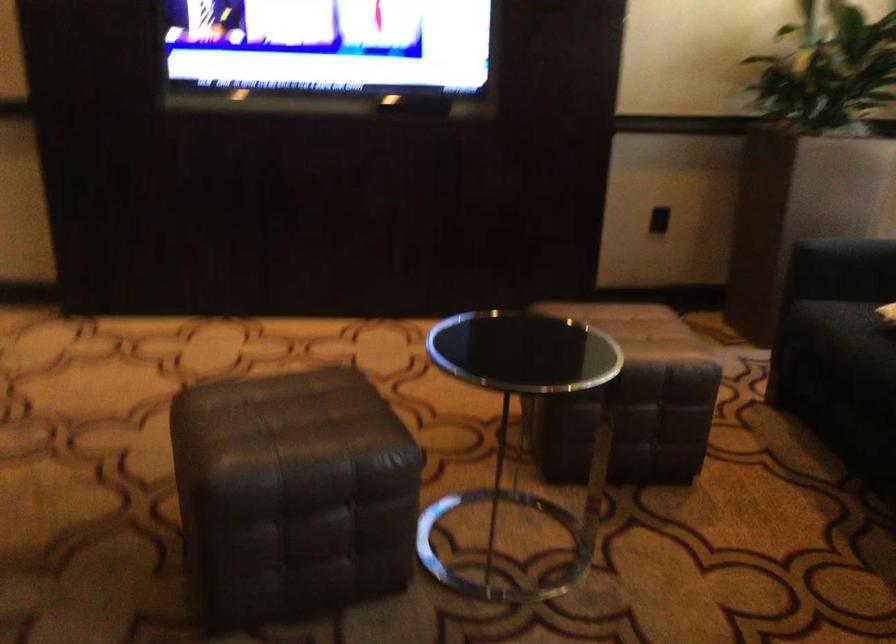
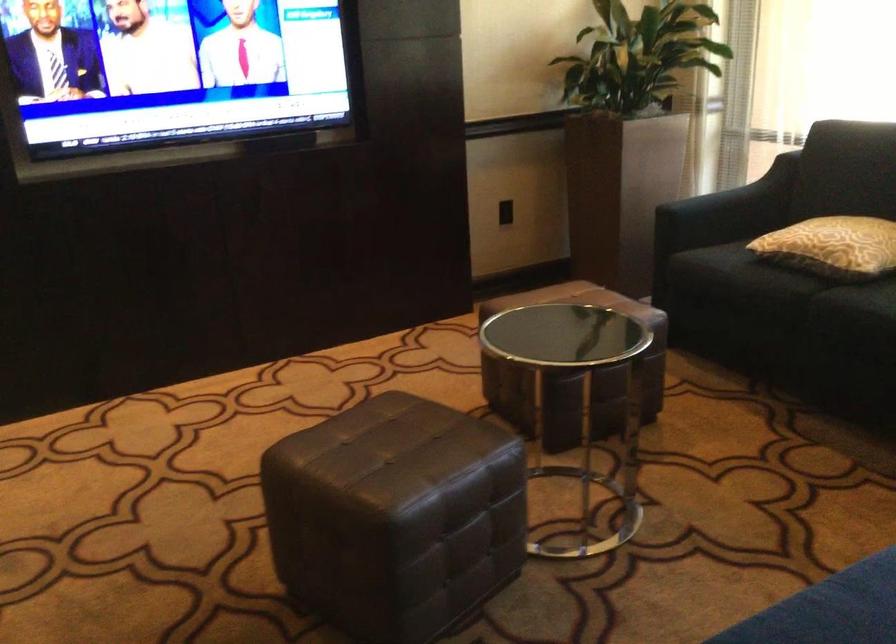
Where in the second image is the point corresponding to (x=578, y=401) from the first image?

(573, 373)